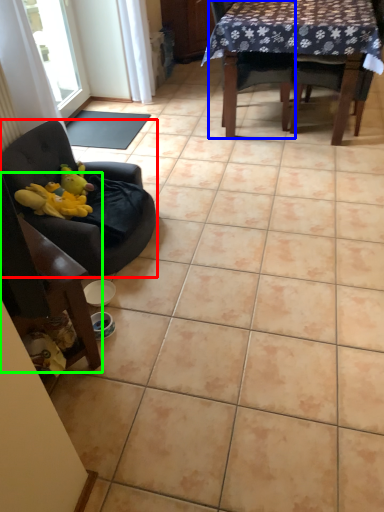
Question: Which object is the farthest from chair (highlighted by a red box)? Choose among these: chair (highlighted by a blue box) or chair (highlighted by a green box).

Choices:
 (A) chair
 (B) chair

Answer: (A)